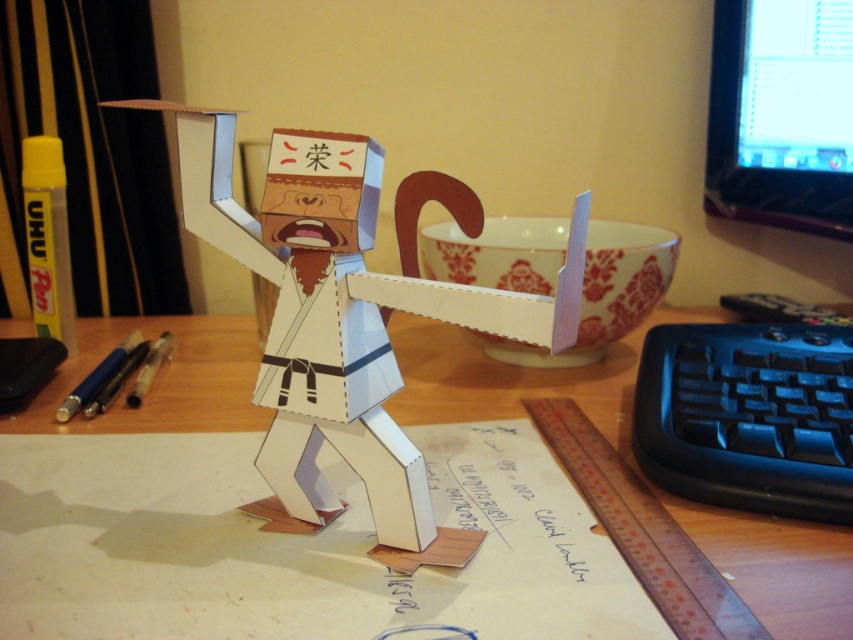
You are a student working on a project and need to place a small sticker on your desk. You have the black plastic keyboard at lower right and the black glossy monitor at upper right. Which object should you place the sticker closer to if you want it near the left side of the monitor?

The black plastic keyboard at lower right is positioned on the left side of the black glossy monitor at upper right, so placing the sticker near the keyboard would position it closer to the left side of the monitor.

Looking at this image, you are a student working on a project and need to reach for either the black plastic keyboard at lower right or the translucent blue pen at lower left. Which object is closer to you?

The black plastic keyboard at lower right is positioned under the translucent blue pen at lower left, meaning the keyboard is closer to you.

You are a student working on a project and need to place a small figurine between the black plastic keyboard at lower right and the black glossy monitor at upper right. Based on their heights, which object will the figurine be closer to?

The black plastic keyboard at lower right has a lesser height compared to the black glossy monitor at upper right. Therefore, the figurine will be closer to the black plastic keyboard at lower right since it is shorter.